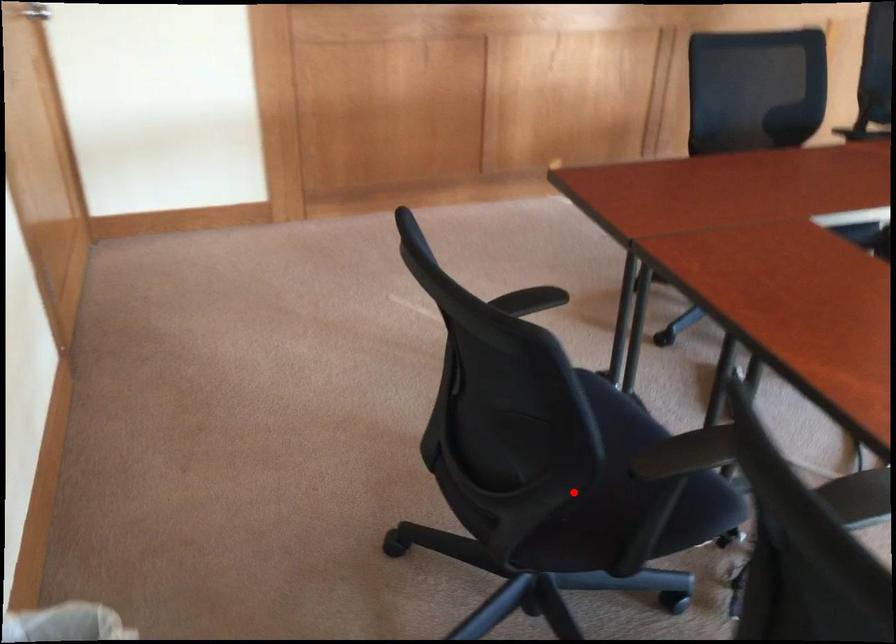
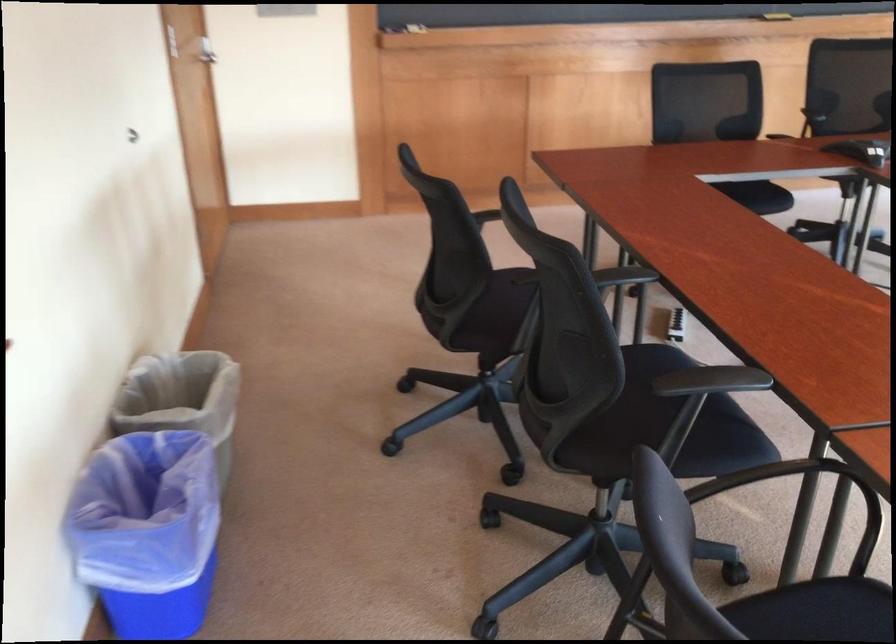
Locate, in the second image, the point that corresponds to the highlighted location in the first image.

(497, 313)